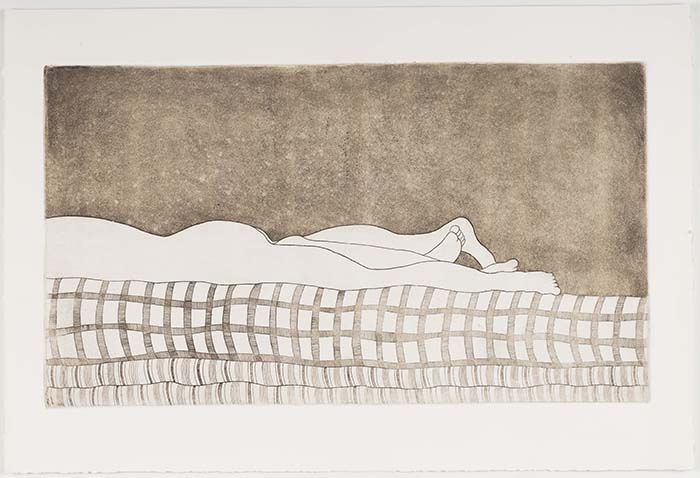
Where is `bed`? bed is located at coordinates [260, 320].